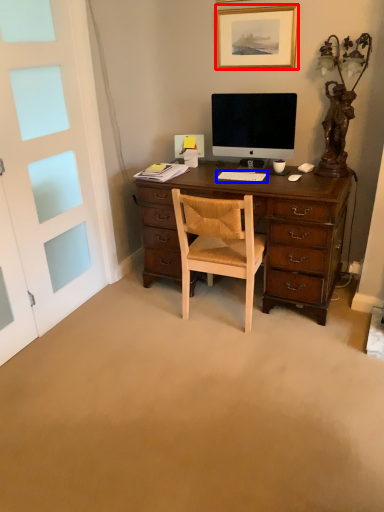
Question: Which object is closer to the camera taking this photo, picture frame (highlighted by a red box) or computer keyboard (highlighted by a blue box)?

Choices:
 (A) picture frame
 (B) computer keyboard

Answer: (A)